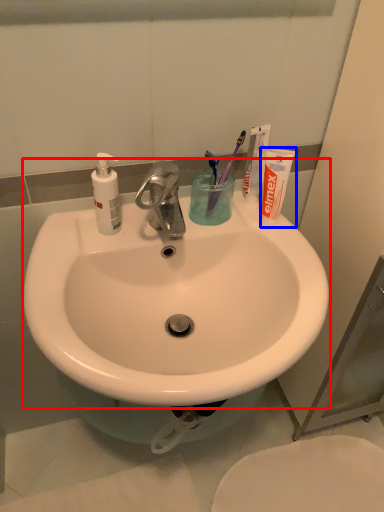
Question: Which point is closer to the camera, sink (highlighted by a red box) or toiletry (highlighted by a blue box)?

Choices:
 (A) sink
 (B) toiletry

Answer: (A)